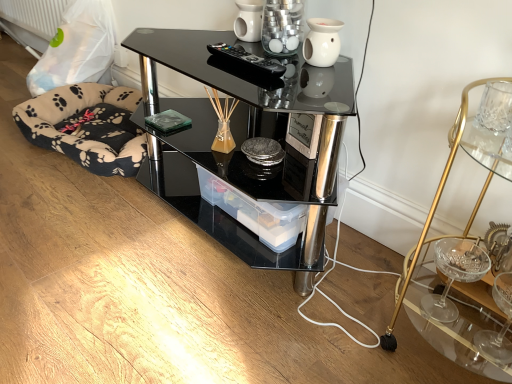
Identify the location of free space to the left of gold metallic cocktail table at right. (347, 328).